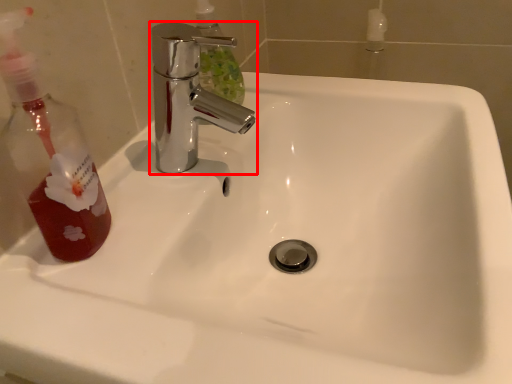
Question: From the image's perspective, where is tap (annotated by the red box) located relative to mouthwash?

Choices:
 (A) above
 (B) below

Answer: (A)